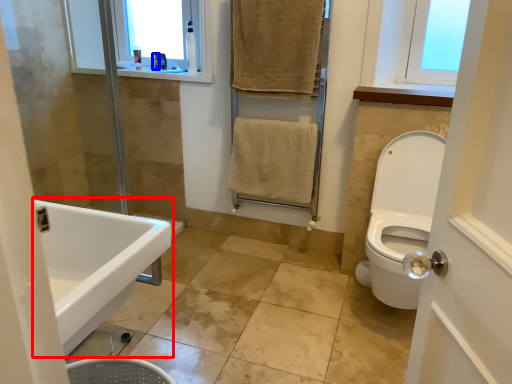
Question: Which of the following is the closest to the observer, sink (highlighted by a red box) or toiletry (highlighted by a blue box)?

Choices:
 (A) sink
 (B) toiletry

Answer: (A)